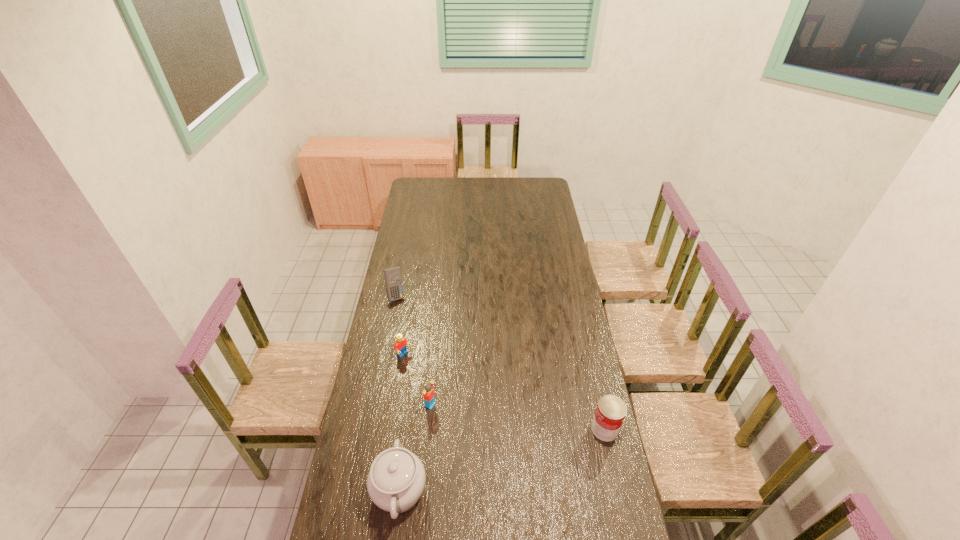
Image resolution: width=960 pixels, height=540 pixels. In order to click on chinaware positioned at the left edge in this screenshot , I will do `click(396, 480)`.

Locate an element on the screen. Lego that is at the left edge is located at coordinates (400, 344).

At what (x,y) coordinates should I click in order to perform the action: click on calculator located at the left edge. Please return your answer as a coordinate pair (x, y). Image resolution: width=960 pixels, height=540 pixels. Looking at the image, I should click on (393, 280).

Identify the location of object situated at the right edge. (611, 410).

You are a GUI agent. You are given a task and a screenshot of the screen. Output one action in this format:
    pyautogui.click(x=<x>, y=<y>)
    Task: Click on the object that is at the near left corner
    Image resolution: width=960 pixels, height=540 pixels.
    Given the screenshot: What is the action you would take?
    pyautogui.click(x=396, y=480)

Where is `vacant space at the left edge of the desktop`? vacant space at the left edge of the desktop is located at coordinates (354, 443).

At what (x,y) coordinates should I click in order to perform the action: click on vacant space at the right edge of the desktop. Please return your answer as a coordinate pair (x, y). This screenshot has height=540, width=960. Looking at the image, I should click on tap(531, 221).

Where is `vacant space at the far left corner of the desktop`? vacant space at the far left corner of the desktop is located at coordinates (419, 193).

In the image, there is a desktop. Identify the location of vacant area at the far right corner. (x=541, y=183).

This screenshot has height=540, width=960. In order to click on unoccupied position between the fourth nearest object and the rightmost object in this screenshot , I will do `click(504, 392)`.